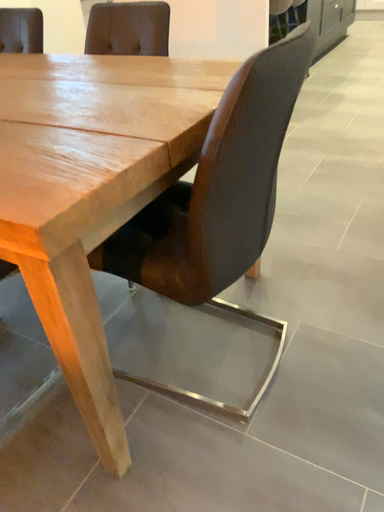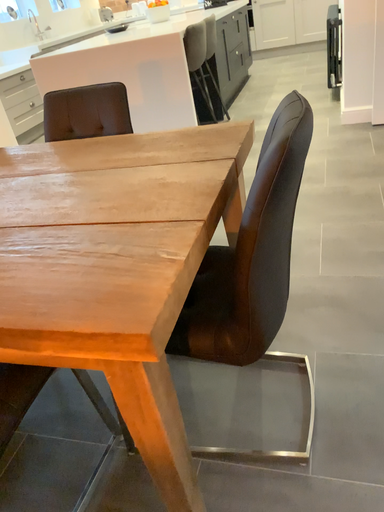
Question: Which way did the camera rotate in the video?

Choices:
 (A) rotated left
 (B) rotated right

Answer: (B)